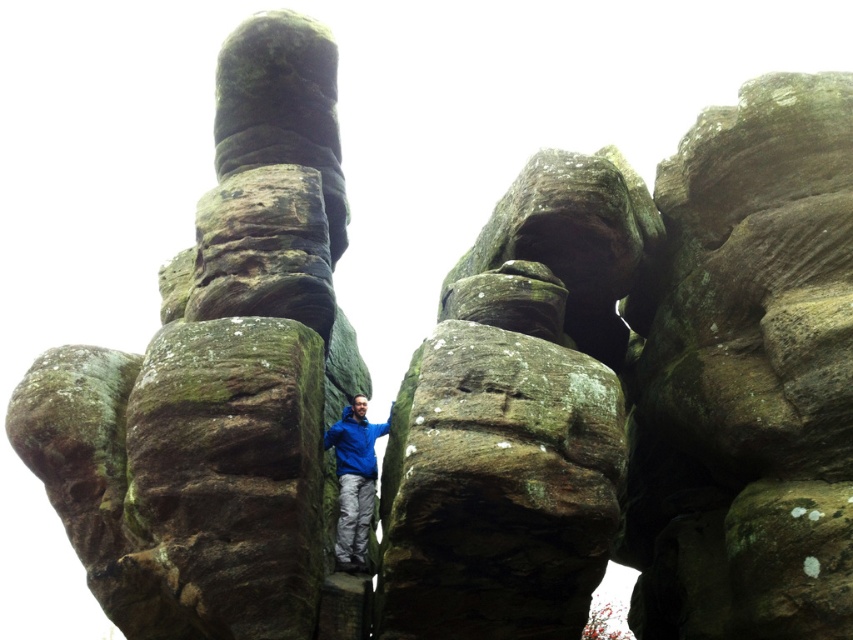
Does blue fabric jacket at center have a larger size compared to blue matte jacket at center?

Indeed, blue fabric jacket at center has a larger size compared to blue matte jacket at center.

Is point (341, 413) in front of point (364, 454)?

No, (341, 413) is further to viewer.

Does point (363, 563) come farther from viewer compared to point (357, 432)?

No, it is in front of (357, 432).

Find the location of `blue fabric jacket at center`. blue fabric jacket at center is located at coordinates (354, 481).

Is green mossy rock at center positioned behind blue matte jacket at center?

No, it is not.

The width and height of the screenshot is (853, 640). What are the coordinates of `green mossy rock at center` in the screenshot? It's located at (221, 381).

Does green mossy rock at center lie behind blue fabric jacket at center?

No, it is in front of blue fabric jacket at center.

Which is more to the right, green mossy rock at center or blue fabric jacket at center?

blue fabric jacket at center

Where is `green mossy rock at center`? green mossy rock at center is located at coordinates (221, 381).

Locate an element on the screen. green mossy rock at center is located at coordinates (221, 381).